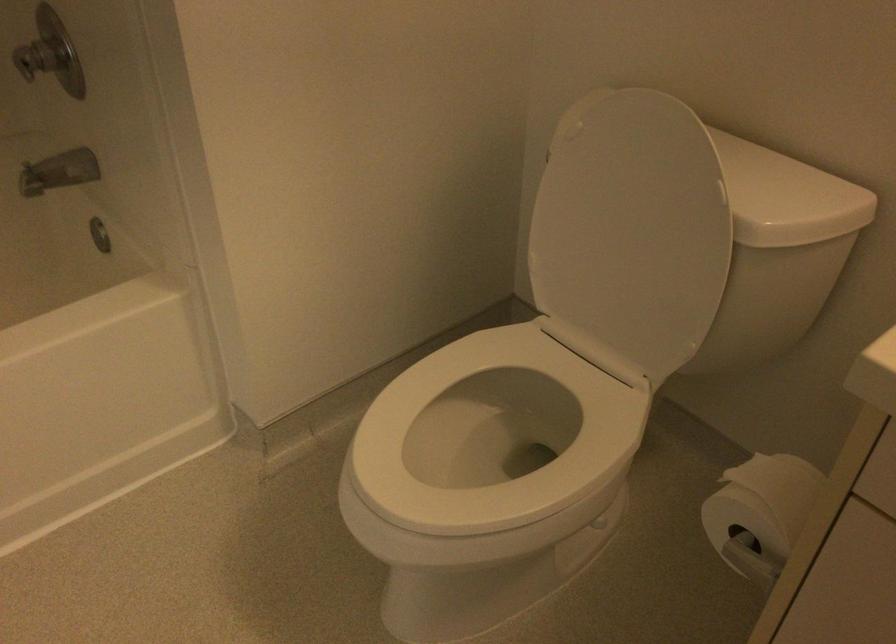
Where is `toilet paper roll`? The width and height of the screenshot is (896, 644). toilet paper roll is located at coordinates (760, 513).